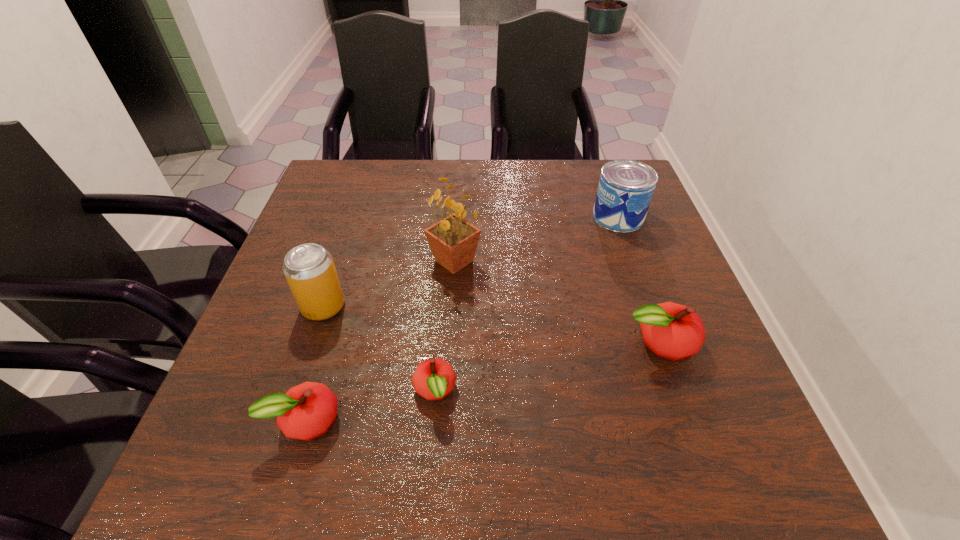
At what (x,y) coordinates should I click in order to perform the action: click on object that is the nearest to the rightmost apple. Please return your answer as a coordinate pair (x, y). Looking at the image, I should click on (625, 189).

Where is `the third closest apple relative to the tallest object`? Image resolution: width=960 pixels, height=540 pixels. the third closest apple relative to the tallest object is located at coordinates (306, 411).

Image resolution: width=960 pixels, height=540 pixels. In order to click on apple that is the closest to the second shortest apple in this screenshot , I will do `click(434, 378)`.

I want to click on vacant region that satisfies the following two spatial constraints: 1. on the front label of the can; 2. at the front of the fifth nearest object with flowers visible, so click(635, 261).

Locate an element on the screen. The width and height of the screenshot is (960, 540). vacant region that satisfies the following two spatial constraints: 1. on the front side of the pop (soda); 2. on the right side of the tallest apple is located at coordinates (311, 342).

At what (x,y) coordinates should I click in order to perform the action: click on vacant space that satisfies the following two spatial constraints: 1. on the front side of the second apple from right to left; 2. on the left side of the pop (soda). Please return your answer as a coordinate pair (x, y). The height and width of the screenshot is (540, 960). Looking at the image, I should click on (295, 392).